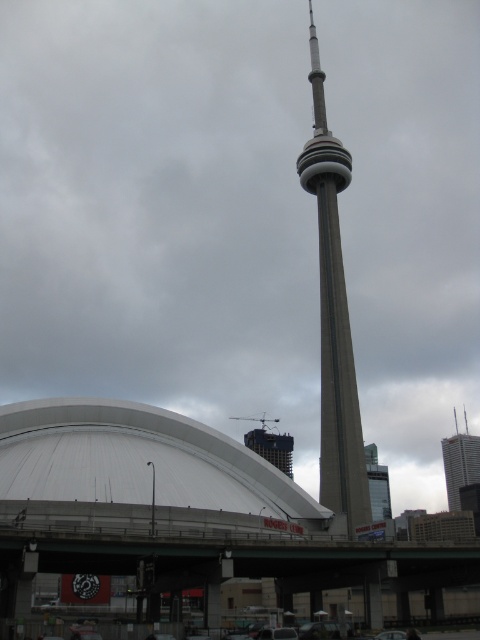
Does concrete tower at center have a greater height compared to gray concrete skyscraper at right?

Correct, concrete tower at center is much taller as gray concrete skyscraper at right.

Is the position of concrete tower at center less distant than that of gray concrete skyscraper at right?

Yes, it is in front of gray concrete skyscraper at right.

Is point (340, 179) more distant than point (456, 500)?

No, (340, 179) is closer to viewer.

Locate an element on the screen. The image size is (480, 640). concrete tower at center is located at coordinates (334, 317).